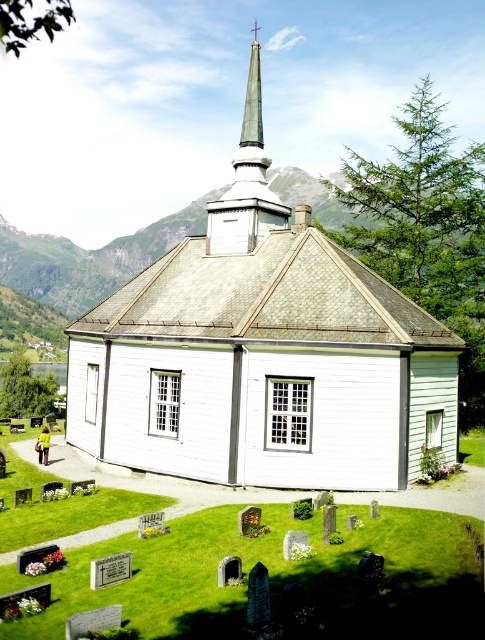
Question: Which point appears farthest from the camera in this image?

Choices:
 (A) (283, 212)
 (B) (214, 444)

Answer: (A)

Question: Which point appears farthest from the camera in this image?

Choices:
 (A) (245, 125)
 (B) (268, 390)

Answer: (A)

Question: Does white wood church at center appear over green polished stone spire at upper center?

Choices:
 (A) no
 (B) yes

Answer: (A)

Question: Where is white wood church at center located in relation to green polished stone spire at upper center in the image?

Choices:
 (A) left
 (B) right

Answer: (A)

Question: Which point appears farthest from the camera in this image?

Choices:
 (A) (405, 397)
 (B) (236, 154)

Answer: (B)

Question: Is white wood church at center wider than green polished stone spire at upper center?

Choices:
 (A) yes
 (B) no

Answer: (A)